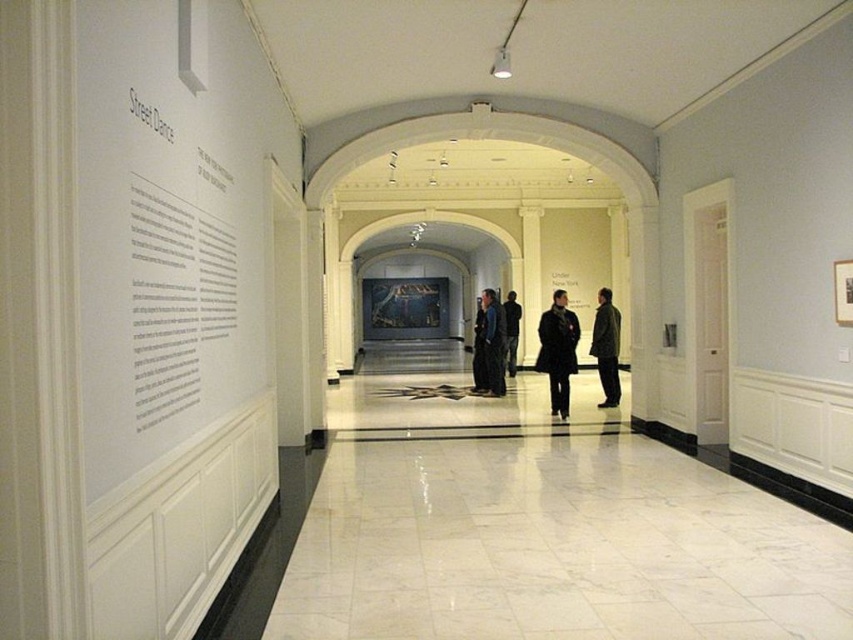
You are a security guard in the museum and you see the dark brown leather jacket at center in the hallway. If the hallway is 12 meters long, can you estimate whether the jacket is within the first half of the hallway or the second half?

The dark brown leather jacket at center is 10.62 meters from camera. Since the hallway is 12 meters long, the halfway point is at 6 meters. Therefore, the jacket is in the second half of the hallway.